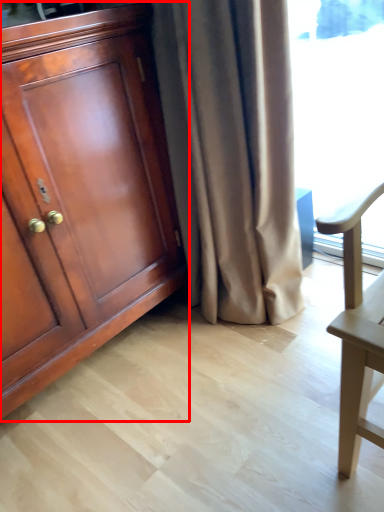
Question: From the image's perspective, where is cabinetry (annotated by the red box) located relative to curtain?

Choices:
 (A) above
 (B) below

Answer: (B)